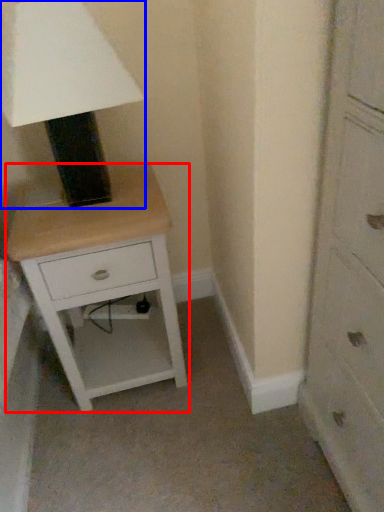
Question: Which point is closer to the camera, nightstand (highlighted by a red box) or table lamp (highlighted by a blue box)?

Choices:
 (A) nightstand
 (B) table lamp

Answer: (B)